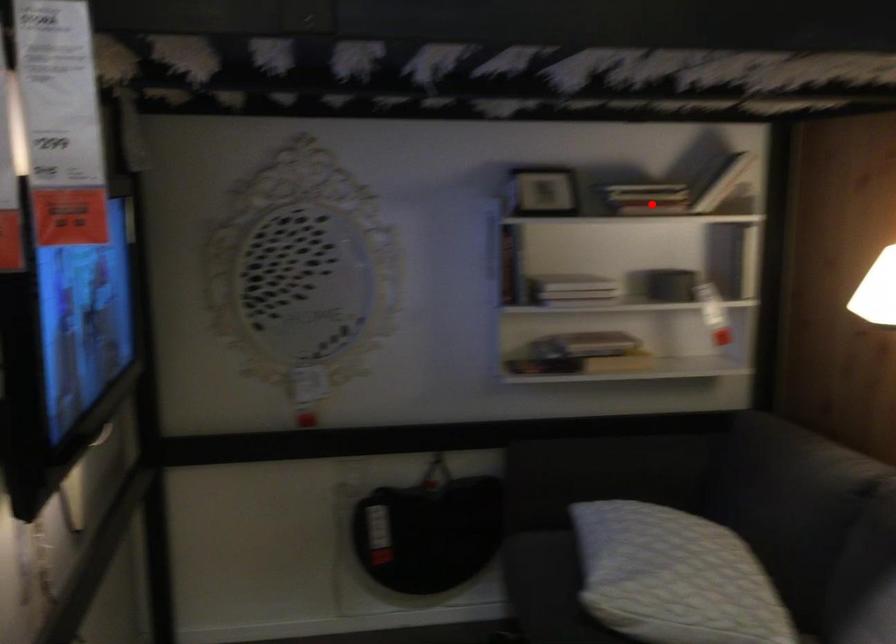
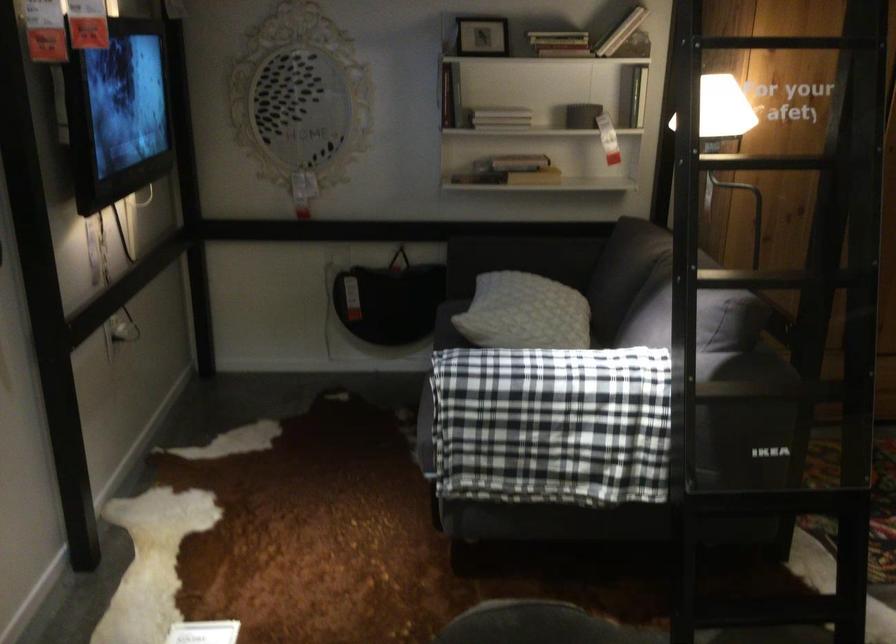
Question: I am providing you with two images of the same scene from different viewpoints. A red point is shown in image1. For the corresponding object point in image2, is it positioned nearer or farther from the camera?

Choices:
 (A) Nearer
 (B) Farther

Answer: (B)